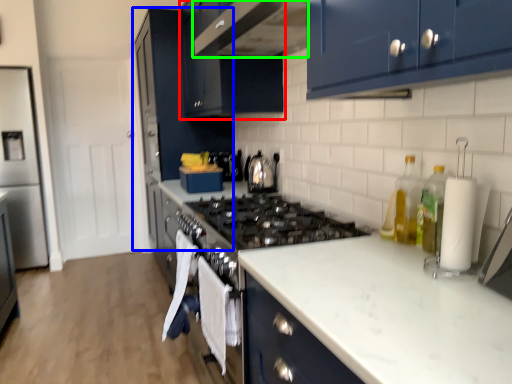
Question: Which object is the closest to the cabinetry (highlighted by a red box)? Choose among these: cabinetry (highlighted by a blue box) or home appliance (highlighted by a green box).

Choices:
 (A) cabinetry
 (B) home appliance

Answer: (B)